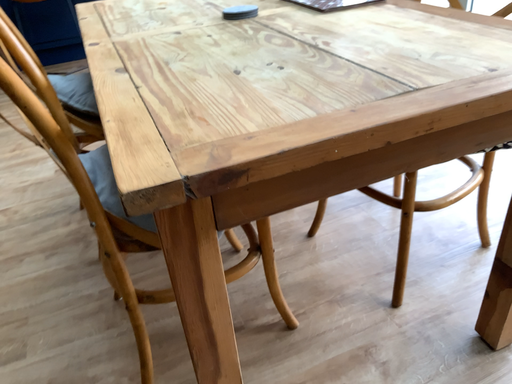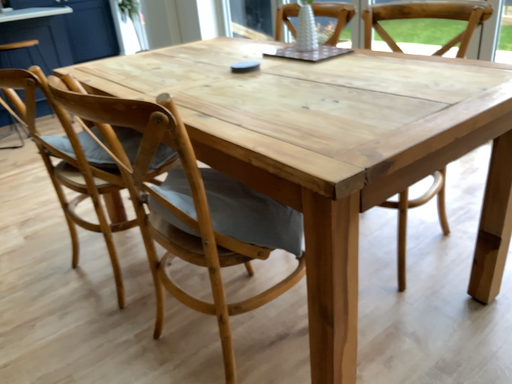
Question: Which way did the camera rotate in the video?

Choices:
 (A) rotated left
 (B) rotated right

Answer: (B)